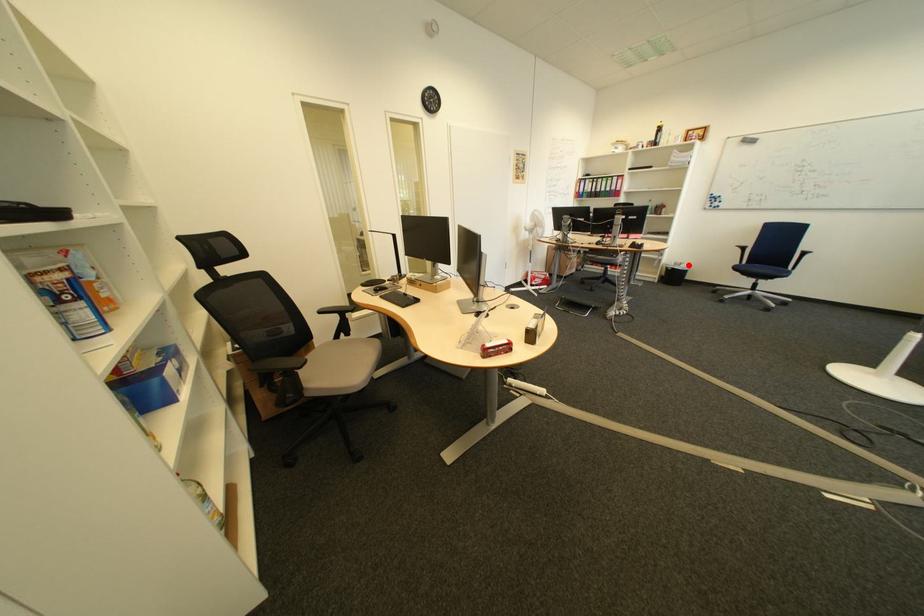
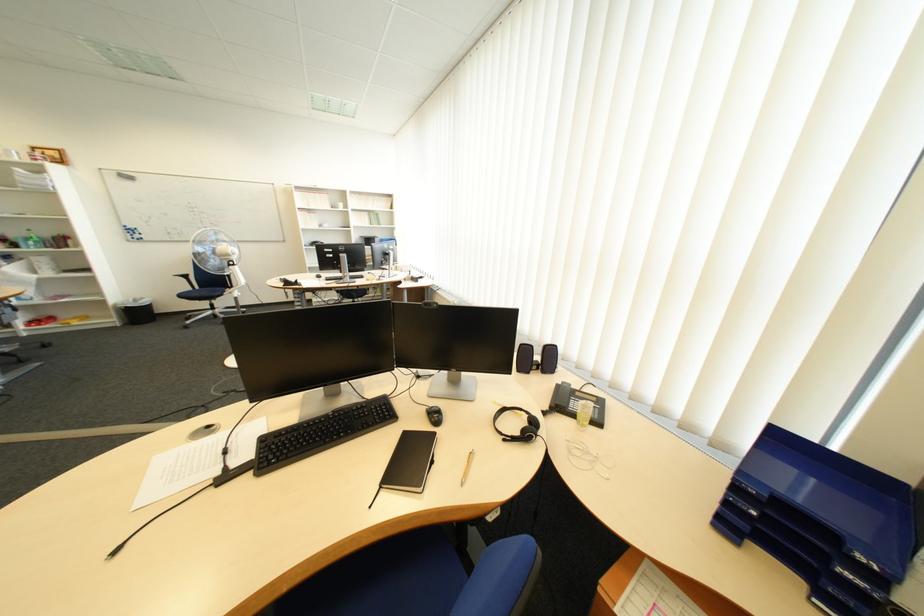
Locate, in the second image, the point that corresponds to the highlighted location in the first image.

(149, 302)